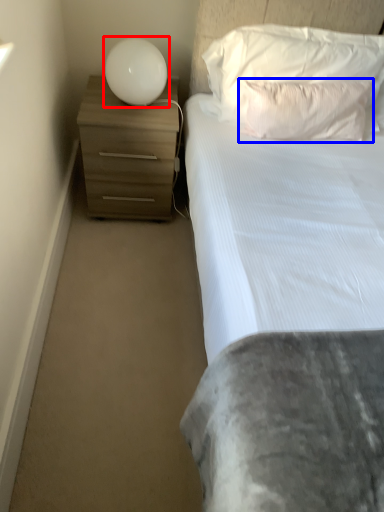
Question: Which object is further to the camera taking this photo, lamp (highlighted by a red box) or pillow (highlighted by a blue box)?

Choices:
 (A) lamp
 (B) pillow

Answer: (A)